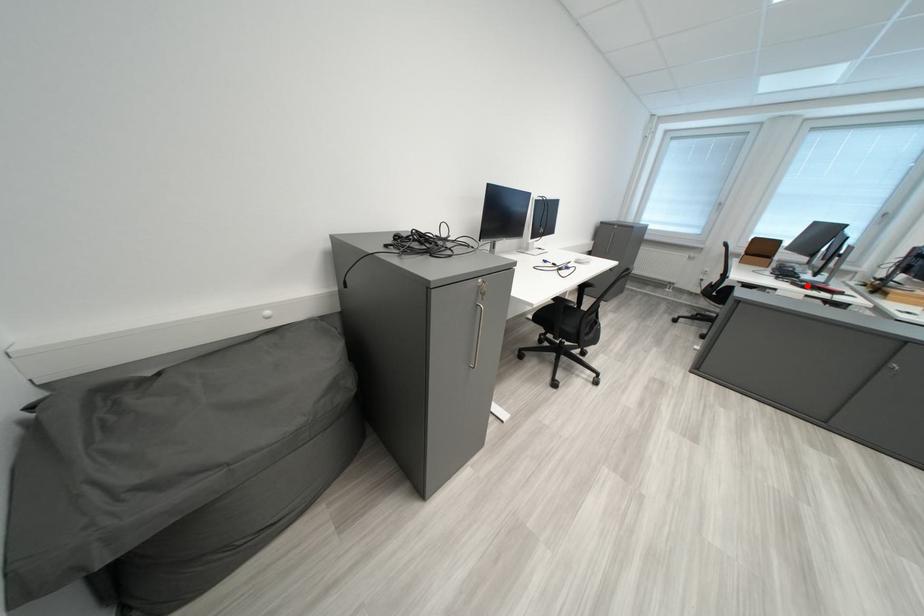
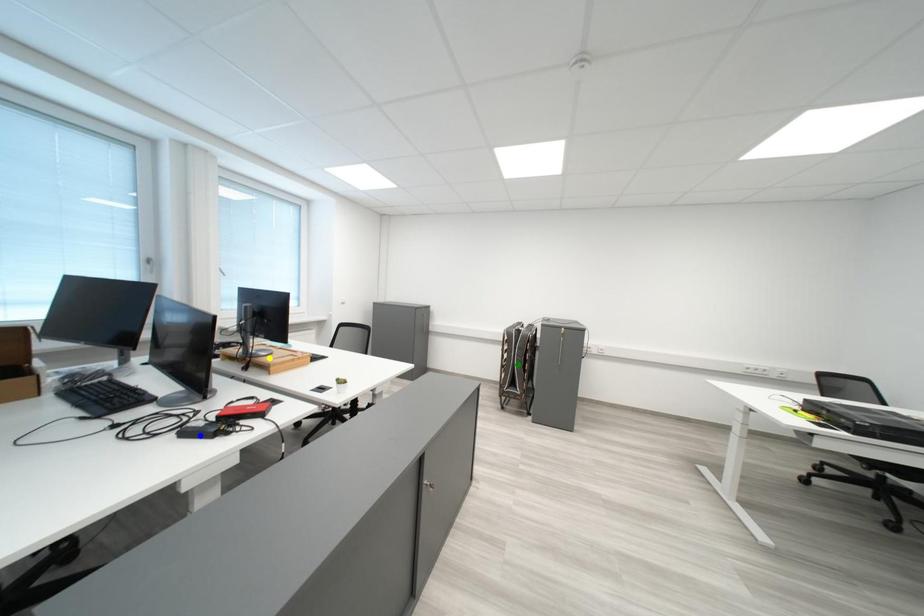
Question: I am providing you with two images of the same scene from different viewpoints. A red point is marked on the first image. You are given multiple points on the second image. Which spot in image 2 lines up with the point in image 1?

Choices:
 (A) yellow point
 (B) blue point
 (C) green point

Answer: (B)